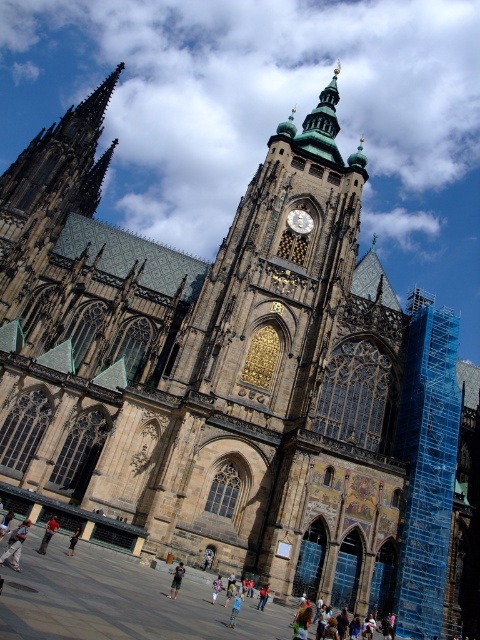
Question: Can you confirm if red fabric pants at center is positioned to the left of dark blue jeans at lower center?

Choices:
 (A) no
 (B) yes

Answer: (B)

Question: Which is nearer to the blue denim jeans at lower center?

Choices:
 (A) gold textured clock at center
 (B) red fabric pants at center

Answer: (B)

Question: Can you confirm if light brown leather pants at lower left is smaller than floral fabric dress at center?

Choices:
 (A) no
 (B) yes

Answer: (A)

Question: Estimate the real-world distances between objects in this image. Which object is farther from the light blue jeans at lower center?

Choices:
 (A) gold textured clock at center
 (B) dark gray fabric pants at lower center

Answer: (A)

Question: Based on their relative distances, which object is nearer to the red fabric pants at center?

Choices:
 (A) gold textured clock at center
 (B) dark blue jeans at lower center
 (C) dark gray fabric pants at lower center
 (D) floral fabric dress at center

Answer: (B)

Question: Does light blue jeans at lower center come behind light brown leather pants at lower left?

Choices:
 (A) yes
 (B) no

Answer: (A)